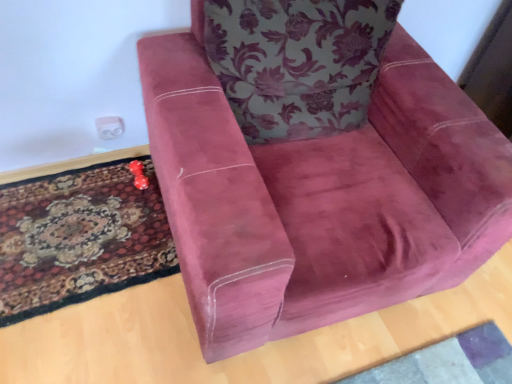
Question: Is rubberized red dice at lower left not within carpeted rug at lower left?

Choices:
 (A) yes
 (B) no

Answer: (A)

Question: Does rubberized red dice at lower left have a lesser width compared to carpeted rug at lower left?

Choices:
 (A) no
 (B) yes

Answer: (B)

Question: From the image's perspective, would you say rubberized red dice at lower left is shown under carpeted rug at lower left?

Choices:
 (A) no
 (B) yes

Answer: (A)

Question: From a real-world perspective, is rubberized red dice at lower left under carpeted rug at lower left?

Choices:
 (A) yes
 (B) no

Answer: (B)

Question: Is rubberized red dice at lower left positioned in front of carpeted rug at lower left?

Choices:
 (A) no
 (B) yes

Answer: (A)

Question: From their relative heights in the image, would you say velvet maroon armchair at center is taller or shorter than floral fabric cushion at upper center?

Choices:
 (A) tall
 (B) short

Answer: (A)

Question: Considering the positions of point (352, 135) and point (294, 119), is point (352, 135) closer or farther from the camera than point (294, 119)?

Choices:
 (A) farther
 (B) closer

Answer: (A)

Question: In terms of size, does velvet maroon armchair at center appear bigger or smaller than floral fabric cushion at upper center?

Choices:
 (A) small
 (B) big

Answer: (B)

Question: From the image's perspective, relative to floral fabric cushion at upper center, is velvet maroon armchair at center above or below?

Choices:
 (A) above
 (B) below

Answer: (B)

Question: From the image's perspective, is floral fabric cushion at upper center positioned above or below carpeted rug at lower left?

Choices:
 (A) above
 (B) below

Answer: (A)

Question: Is floral fabric cushion at upper center wider or thinner than carpeted rug at lower left?

Choices:
 (A) wide
 (B) thin

Answer: (B)

Question: In terms of size, does floral fabric cushion at upper center appear bigger or smaller than carpeted rug at lower left?

Choices:
 (A) small
 (B) big

Answer: (B)

Question: From a real-world perspective, relative to carpeted rug at lower left, is floral fabric cushion at upper center vertically above or below?

Choices:
 (A) above
 (B) below

Answer: (A)

Question: From the image's perspective, is carpeted rug at lower left located above or below velvet maroon armchair at center?

Choices:
 (A) above
 (B) below

Answer: (B)

Question: Relative to velvet maroon armchair at center, is carpeted rug at lower left in front or behind?

Choices:
 (A) front
 (B) behind

Answer: (B)